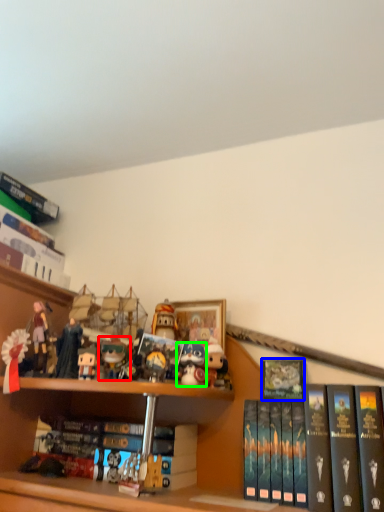
Question: Which object is positioned closest to toy (highlighted by a red box)? Select from book (highlighted by a blue box) and toy (highlighted by a green box).

Choices:
 (A) book
 (B) toy

Answer: (B)